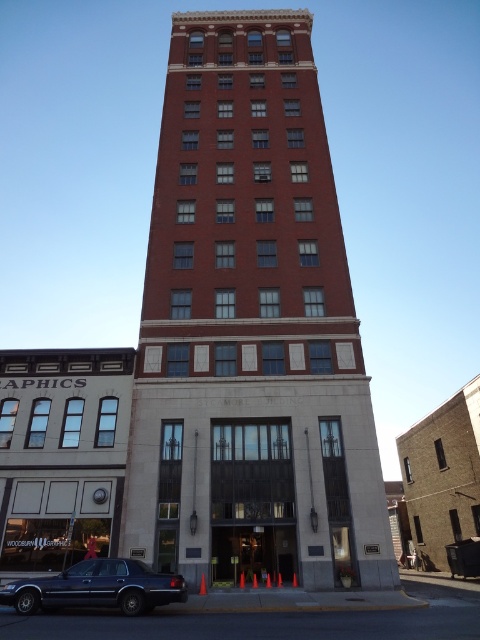
You are a delivery person trying to park your van near the red brick building at center and the metallic silver clock at center. Since the van is 2 meters wide, will it fit between the two objects if there is a 2.5 meter gap between them?

The gap between the red brick building at center and the metallic silver clock at center is 2.5 meters, which is wider than the van. Therefore, the van can fit between them.